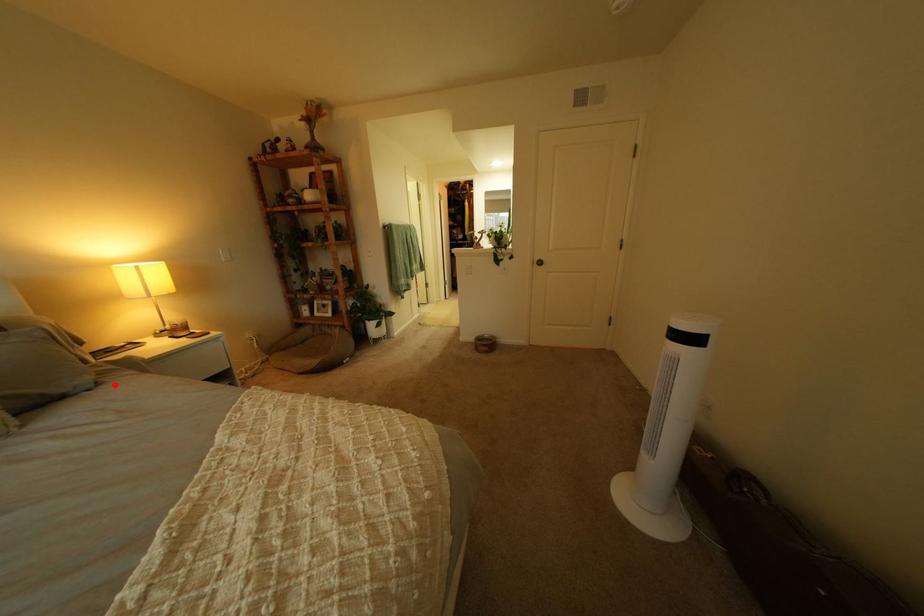
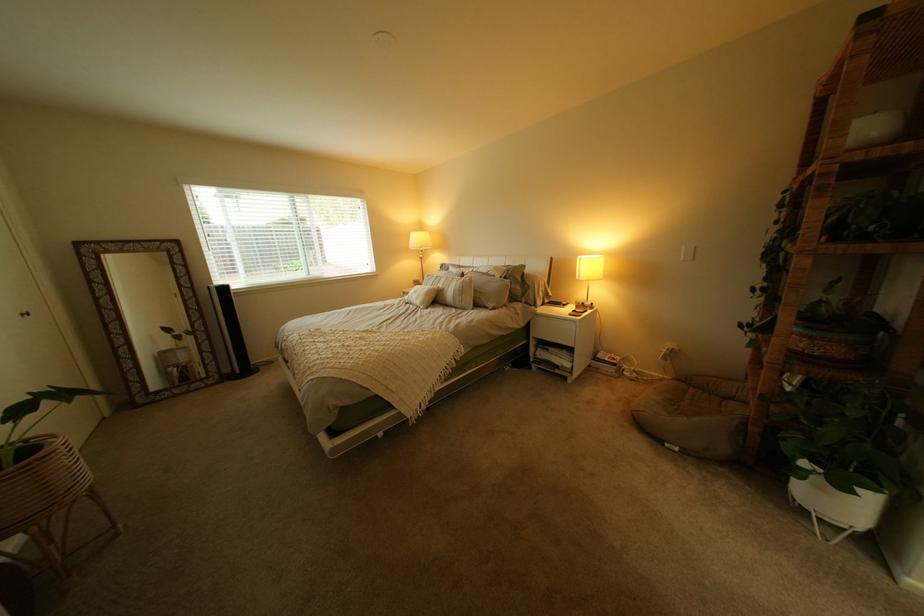
Find the pixel in the second image that matches the highlighted location in the first image.

(509, 310)